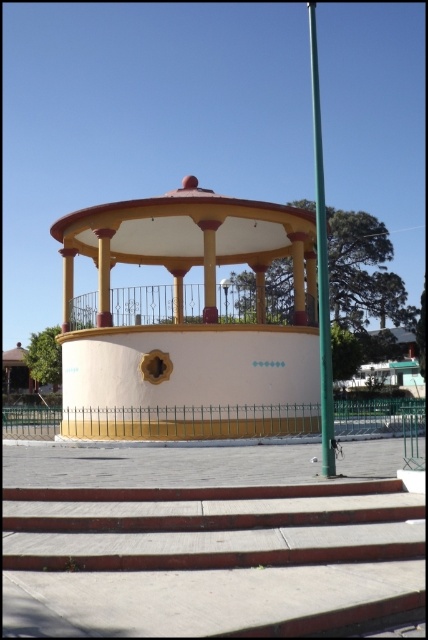
Question: Which object is positioned farthest from the concrete steps at center?

Choices:
 (A) green metallic pole at right
 (B) matte yellow gazebo at center

Answer: (B)

Question: Is concrete steps at center to the left of green metallic pole at right from the viewer's perspective?

Choices:
 (A) no
 (B) yes

Answer: (B)

Question: Which of the following is the farthest from the observer?

Choices:
 (A) (157, 256)
 (B) (261, 570)

Answer: (A)

Question: Is concrete steps at center above green metallic pole at right?

Choices:
 (A) no
 (B) yes

Answer: (A)

Question: Which point is closer to the camera?

Choices:
 (A) green metallic pole at right
 (B) concrete steps at center
 (C) matte yellow gazebo at center

Answer: (B)

Question: Is concrete steps at center to the right of matte yellow gazebo at center from the viewer's perspective?

Choices:
 (A) no
 (B) yes

Answer: (B)